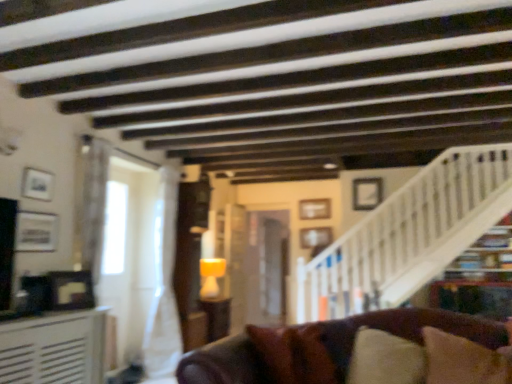
Question: In terms of height, does matte silver picture frame at left, marked as the 2th picture frame in a left-to-right arrangement, look taller or shorter compared to white matte picture frame at upper right, which is the first picture frame from right to left?

Choices:
 (A) tall
 (B) short

Answer: (B)

Question: Is point (55, 231) positioned closer to the camera than point (369, 190)?

Choices:
 (A) farther
 (B) closer

Answer: (B)

Question: Based on their relative distances, which object is farther from the matte silver picture frame at left, the first picture frame viewed from the front?

Choices:
 (A) brown fabric pillow at lower right
 (B) matte orange lampshade at center
 (C) wooden picture frame at center, placed as the 3th picture frame when sorted from right to left
 (D) white matte picture frame at upper right, the 5th picture frame when ordered from left to right
 (E) white wooden stairwell at upper right

Answer: (D)

Question: Which object is positioned farthest from the white wooden stairwell at upper right?

Choices:
 (A) wooden picture frame at center, which is the fourth picture frame from front to back
 (B) wooden picture frame at center, the 5th picture frame from the front
 (C) brown leather couch at lower center
 (D) matte brown table at center, the 2th table from the front
 (E) brown fabric pillow at lower right

Answer: (E)